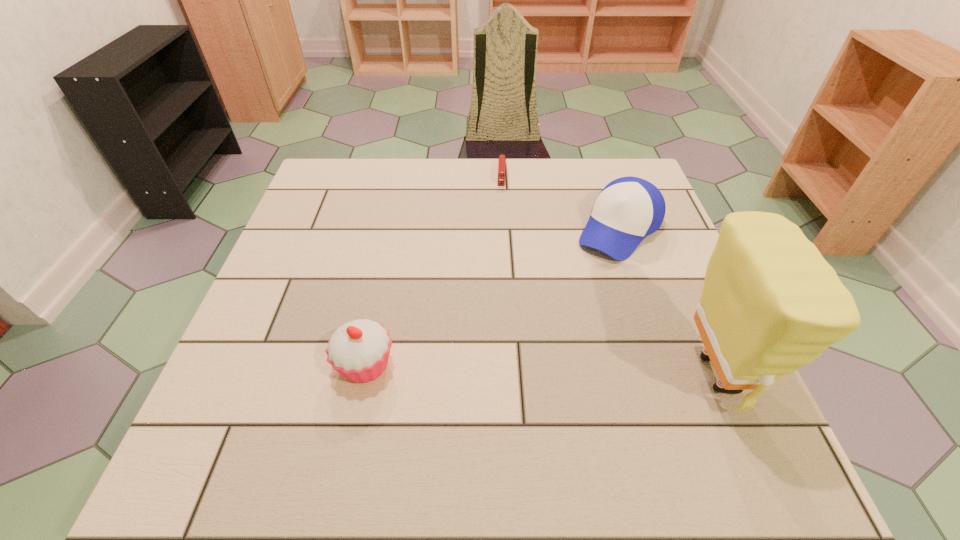
Find the location of `vacant space that's between the second farthest object and the cupcake`. vacant space that's between the second farthest object and the cupcake is located at coordinates (492, 298).

At what (x,y) coordinates should I click in order to perform the action: click on vacant area that lies between the baseball cap and the shortest object. Please return your answer as a coordinate pair (x, y). Image resolution: width=960 pixels, height=540 pixels. Looking at the image, I should click on (561, 202).

I want to click on free space between the leftmost object and the tallest object, so click(540, 370).

At what (x,y) coordinates should I click in order to perform the action: click on vacant space that is in between the tallest object and the baseball cap. Please return your answer as a coordinate pair (x, y). The height and width of the screenshot is (540, 960). Looking at the image, I should click on (668, 302).

This screenshot has width=960, height=540. Find the location of `free spot between the tallest object and the leftmost object`. free spot between the tallest object and the leftmost object is located at coordinates (540, 370).

You are a GUI agent. You are given a task and a screenshot of the screen. Output one action in this format:
    pyautogui.click(x=<x>, y=<y>)
    Task: Click on the unoccupied area between the sponge and the shortest object
    The width and height of the screenshot is (960, 540).
    Given the screenshot: What is the action you would take?
    pyautogui.click(x=609, y=274)

Locate an element on the screen. The height and width of the screenshot is (540, 960). unoccupied position between the third object from right to left and the tallest object is located at coordinates (609, 274).

You are a GUI agent. You are given a task and a screenshot of the screen. Output one action in this format:
    pyautogui.click(x=<x>, y=<y>)
    Task: Click on the third closest object to the baseball cap
    The height and width of the screenshot is (540, 960).
    Given the screenshot: What is the action you would take?
    pyautogui.click(x=359, y=350)

Identify the location of object that stands as the second closest to the baseball cap. The image size is (960, 540). (771, 304).

Locate an element on the screen. The width and height of the screenshot is (960, 540). free location that satisfies the following two spatial constraints: 1. on the front side of the sponge; 2. on the face of the shortest object is located at coordinates (514, 374).